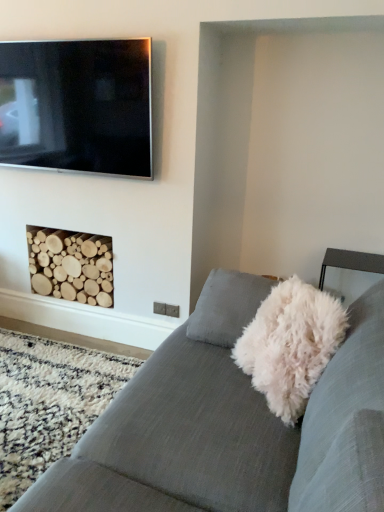
Question: Is textured gray couch at center positioned behind flat screen tv at upper left?

Choices:
 (A) no
 (B) yes

Answer: (A)

Question: Is textured gray couch at center wider than flat screen tv at upper left?

Choices:
 (A) yes
 (B) no

Answer: (A)

Question: Is textured gray couch at center oriented away from flat screen tv at upper left?

Choices:
 (A) yes
 (B) no

Answer: (B)

Question: From the image's perspective, does textured gray couch at center appear lower than flat screen tv at upper left?

Choices:
 (A) no
 (B) yes

Answer: (B)

Question: Is textured gray couch at center to the right of flat screen tv at upper left from the viewer's perspective?

Choices:
 (A) yes
 (B) no

Answer: (A)

Question: Is textured gray couch at center aimed at flat screen tv at upper left?

Choices:
 (A) no
 (B) yes

Answer: (A)

Question: Is the depth of flat screen tv at upper left greater than that of textured gray couch at center?

Choices:
 (A) no
 (B) yes

Answer: (B)

Question: Is flat screen tv at upper left positioned before textured gray couch at center?

Choices:
 (A) no
 (B) yes

Answer: (A)

Question: Does flat screen tv at upper left have a greater height compared to textured gray couch at center?

Choices:
 (A) no
 (B) yes

Answer: (B)

Question: From a real-world perspective, does flat screen tv at upper left stand above textured gray couch at center?

Choices:
 (A) no
 (B) yes

Answer: (B)

Question: Considering the relative sizes of flat screen tv at upper left and textured gray couch at center in the image provided, is flat screen tv at upper left thinner than textured gray couch at center?

Choices:
 (A) no
 (B) yes

Answer: (B)

Question: From a real-world perspective, is flat screen tv at upper left below textured gray couch at center?

Choices:
 (A) no
 (B) yes

Answer: (A)

Question: Would you say flat screen tv at upper left is part of natural wood logs at lower left's contents?

Choices:
 (A) no
 (B) yes

Answer: (A)